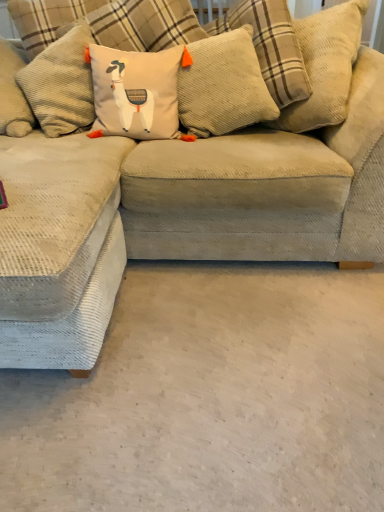
What are the coordinates of `free point above white carpet at lower left (from a real-world perspective)` in the screenshot? It's located at (220, 380).